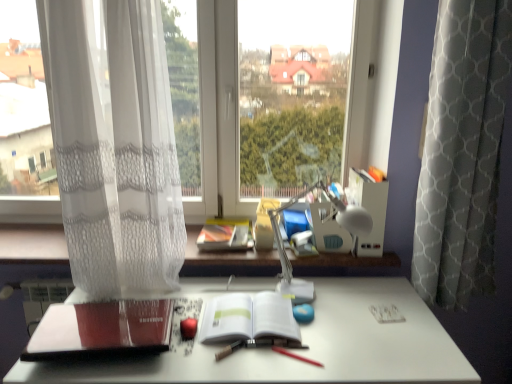
This screenshot has width=512, height=384. I want to click on vacant area that is situated to the right of smooth red crayon at center, so click(x=351, y=355).